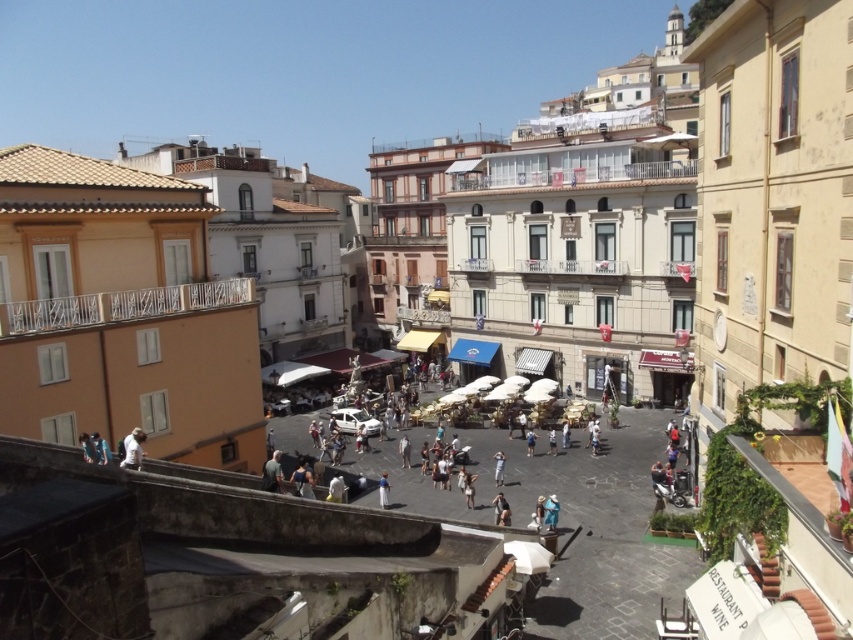
You are a photographer standing in the street scene, and you want to take a photo of the dark gray fabric bag at center without the white fabric shirt at lower left blocking it. How should you adjust your position?

Move to the side so that the white fabric shirt at lower left is no longer in front of the dark gray fabric bag at center.

You are a tourist in this Mediterranean town and you see two people wearing white shirts. One is wearing a white fabric shirt at lower left and the other is wearing a white cotton shirt at center. Which person is standing to the left of the other?

The white fabric shirt at lower left is positioned on the left side of white cotton shirt at center, so the person wearing the white fabric shirt at lower left is standing to the left of the person wearing the white cotton shirt at center.

You are a photographer standing in the street scene and want to take a photo that includes both the white fabric shirt at lower left and the white cotton shirt at center. Which shirt should you focus on first to ensure both are in the frame?

The white fabric shirt at lower left is located above the white cotton shirt at center, so you should focus on the white cotton shirt at center first to ensure both are in the frame.